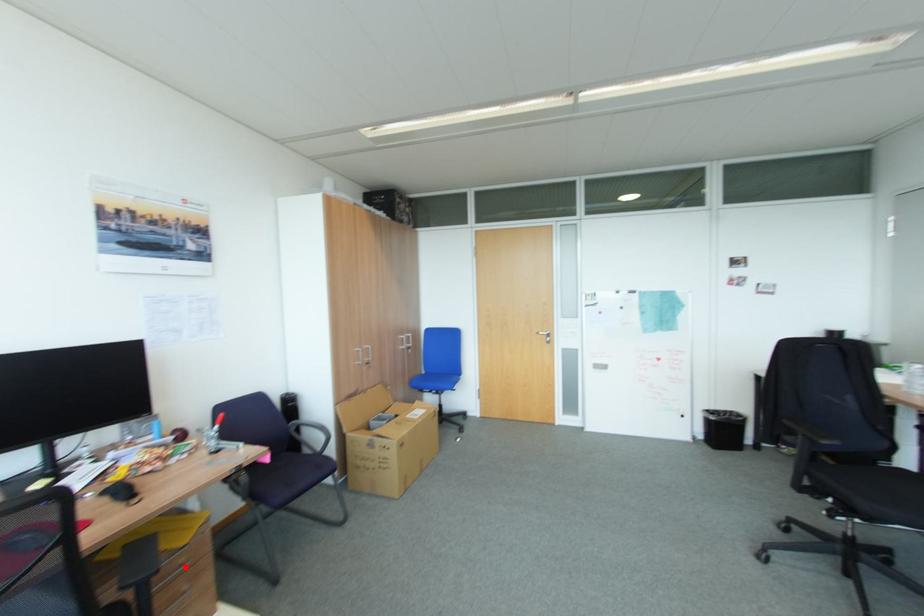
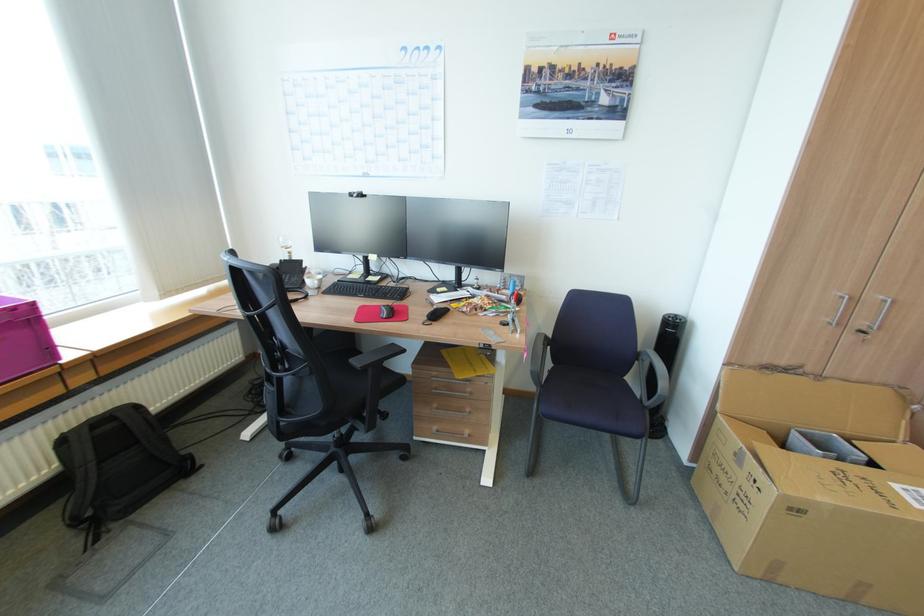
Question: I am providing you with two images of the same scene from different viewpoints. Given a red point in image1, look at the same physical point in image2. Is it:

Choices:
 (A) Closer to the viewpoint
 (B) Farther from the viewpoint

Answer: (B)